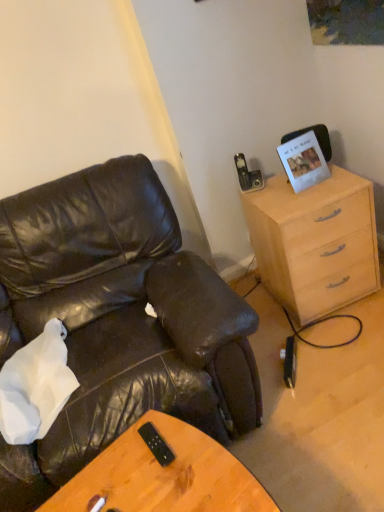
Question: Is the surface of black plastic remote at center in direct contact with white paper picture frame at upper right?

Choices:
 (A) yes
 (B) no

Answer: (B)

Question: Would you say black plastic remote at center is outside white paper picture frame at upper right?

Choices:
 (A) no
 (B) yes

Answer: (B)

Question: From a real-world perspective, is black plastic remote at center located beneath white paper picture frame at upper right?

Choices:
 (A) yes
 (B) no

Answer: (A)

Question: Does black plastic remote at center have a greater height compared to white paper picture frame at upper right?

Choices:
 (A) yes
 (B) no

Answer: (B)

Question: Is black plastic remote at center behind white paper picture frame at upper right?

Choices:
 (A) yes
 (B) no

Answer: (B)

Question: Does point (299, 138) appear closer or farther from the camera than point (240, 315)?

Choices:
 (A) farther
 (B) closer

Answer: (A)

Question: Would you say white paper picture frame at upper right is inside or outside matte black leather chair at left?

Choices:
 (A) outside
 (B) inside

Answer: (A)

Question: Looking at the image, does white paper picture frame at upper right seem bigger or smaller compared to matte black leather chair at left?

Choices:
 (A) big
 (B) small

Answer: (B)

Question: Considering their positions, is white paper picture frame at upper right located in front of or behind matte black leather chair at left?

Choices:
 (A) behind
 (B) front

Answer: (A)

Question: Is white paper picture frame at upper right spatially inside light wood/finish cabinet at right, or outside of it?

Choices:
 (A) inside
 (B) outside

Answer: (B)

Question: From the image's perspective, is white paper picture frame at upper right located above or below light wood/finish cabinet at right?

Choices:
 (A) below
 (B) above

Answer: (B)

Question: Is white paper picture frame at upper right taller or shorter than light wood/finish cabinet at right?

Choices:
 (A) short
 (B) tall

Answer: (A)

Question: Considering the positions of white paper picture frame at upper right and light wood/finish cabinet at right in the image, is white paper picture frame at upper right bigger or smaller than light wood/finish cabinet at right?

Choices:
 (A) big
 (B) small

Answer: (B)

Question: Looking at their shapes, would you say black plastic remote at center is wider or thinner than matte black leather chair at left?

Choices:
 (A) thin
 (B) wide

Answer: (A)

Question: Is point (162, 463) positioned closer to the camera than point (84, 303)?

Choices:
 (A) farther
 (B) closer

Answer: (B)